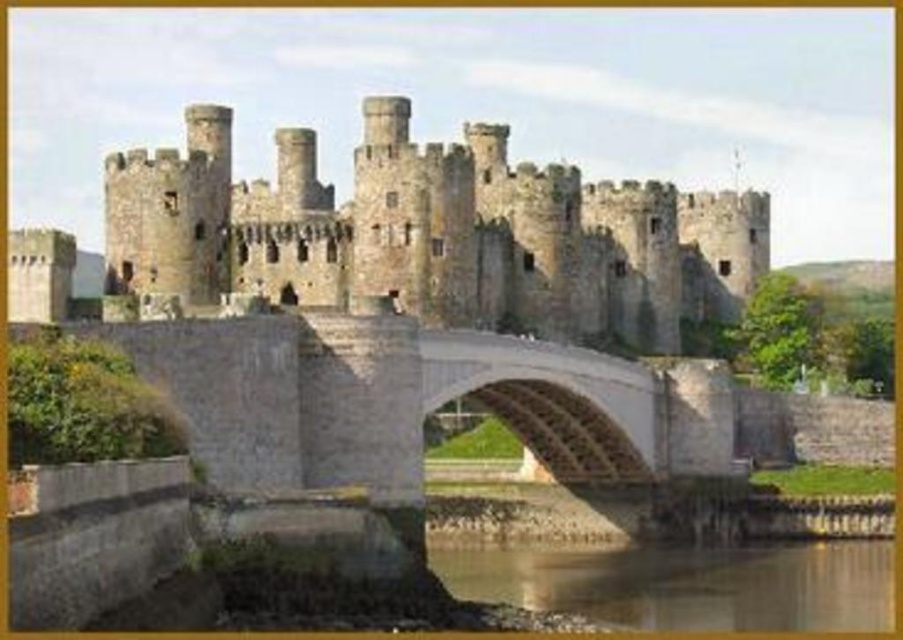
Question: Which point is farther to the camera?

Choices:
 (A) (597, 557)
 (B) (303, 154)

Answer: (B)

Question: Does rustic stone castle at center appear under stone bridge at center?

Choices:
 (A) yes
 (B) no

Answer: (B)

Question: Which of these objects is positioned farthest from the stone bridge at center?

Choices:
 (A) reflective glass water at lower center
 (B) rustic stone castle at center

Answer: (B)

Question: Can you confirm if rustic stone castle at center is wider than reflective glass water at lower center?

Choices:
 (A) yes
 (B) no

Answer: (A)

Question: Which of these objects is positioned farthest from the reflective glass water at lower center?

Choices:
 (A) rustic stone castle at center
 (B) stone bridge at center

Answer: (A)

Question: Does rustic stone castle at center have a larger size compared to reflective glass water at lower center?

Choices:
 (A) yes
 (B) no

Answer: (A)